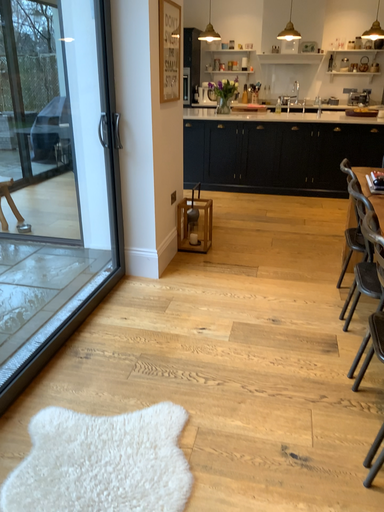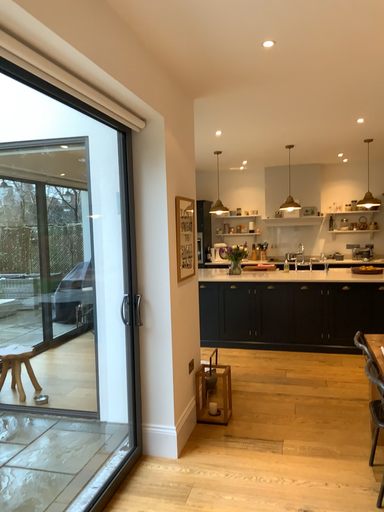
Question: How did the camera likely rotate when shooting the video?

Choices:
 (A) rotated upward
 (B) rotated downward

Answer: (A)